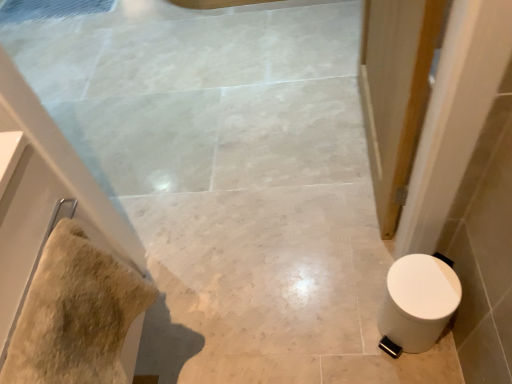
Question: Is beige fluffy towel at left located outside white glossy toilet at lower right?

Choices:
 (A) yes
 (B) no

Answer: (A)

Question: From the image's perspective, is beige fluffy towel at left located beneath white glossy toilet at lower right?

Choices:
 (A) no
 (B) yes

Answer: (A)

Question: Is beige fluffy towel at left oriented away from white glossy toilet at lower right?

Choices:
 (A) yes
 (B) no

Answer: (B)

Question: Does beige fluffy towel at left have a lesser width compared to white glossy toilet at lower right?

Choices:
 (A) yes
 (B) no

Answer: (A)

Question: Is beige fluffy towel at left taller than white glossy toilet at lower right?

Choices:
 (A) no
 (B) yes

Answer: (A)

Question: Is the depth of beige fluffy towel at left greater than that of white glossy toilet at lower right?

Choices:
 (A) no
 (B) yes

Answer: (A)

Question: Would you say white glossy toilet at lower right is a long distance from beige fluffy towel at left?

Choices:
 (A) no
 (B) yes

Answer: (A)

Question: From a real-world perspective, is white glossy toilet at lower right over beige fluffy towel at left?

Choices:
 (A) yes
 (B) no

Answer: (B)

Question: Is the position of white glossy toilet at lower right more distant than that of beige fluffy towel at left?

Choices:
 (A) no
 (B) yes

Answer: (B)

Question: Does white glossy toilet at lower right have a larger size compared to beige fluffy towel at left?

Choices:
 (A) yes
 (B) no

Answer: (A)

Question: Can you confirm if white glossy toilet at lower right is taller than beige fluffy towel at left?

Choices:
 (A) yes
 (B) no

Answer: (A)

Question: Does white glossy toilet at lower right have a greater width compared to beige fluffy towel at left?

Choices:
 (A) yes
 (B) no

Answer: (A)

Question: From the image's perspective, relative to white glossy toilet at lower right, is beige fluffy towel at left above or below?

Choices:
 (A) below
 (B) above

Answer: (B)